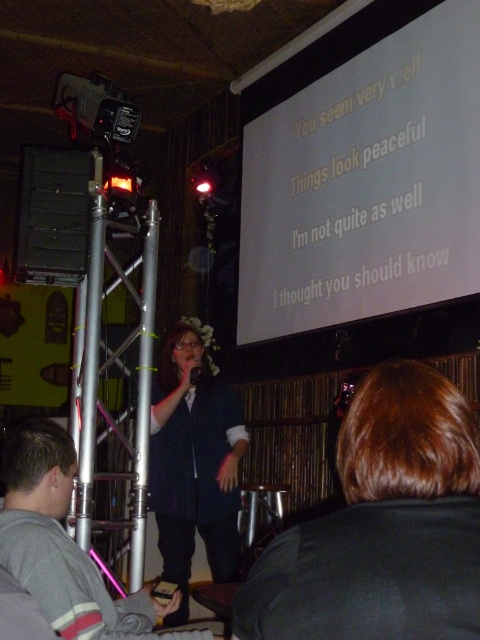
Question: Among these objects, which one is farthest from the camera?

Choices:
 (A) matte black microphone at center
 (B) matte black vest at center
 (C) white matte projection screen at upper center

Answer: (A)

Question: Is black fabric at upper right to the right of black matte speaker at left from the viewer's perspective?

Choices:
 (A) yes
 (B) no

Answer: (A)

Question: Where is black fabric at upper right located in relation to black matte speaker at left in the image?

Choices:
 (A) left
 (B) right

Answer: (B)

Question: Which point appears closest to the camera in this image?

Choices:
 (A) (11, 563)
 (B) (468, 49)
 (C) (70, 182)

Answer: (A)

Question: Which of the following is the closest to the observer?

Choices:
 (A) (43, 432)
 (B) (153, 433)

Answer: (A)

Question: Does black fabric at upper right have a greater width compared to matte black vest at center?

Choices:
 (A) no
 (B) yes

Answer: (A)